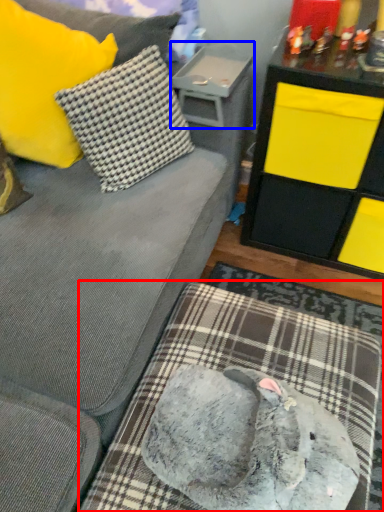
Question: Which object appears farthest to the camera in this image, dog bed (highlighted by a red box) or table (highlighted by a blue box)?

Choices:
 (A) dog bed
 (B) table

Answer: (B)